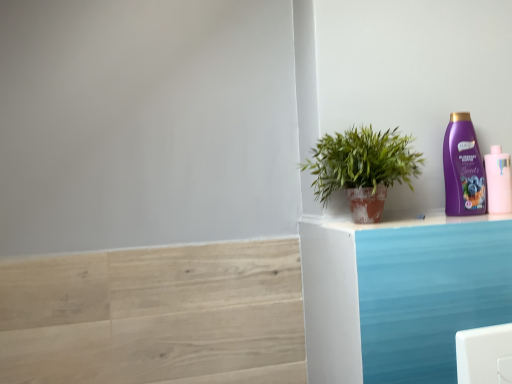
Question: Choose the correct answer: Is pink matte bottle at upper right, the second bottle from the left, inside green leafy plant in terracotta pot at right or outside it?

Choices:
 (A) inside
 (B) outside

Answer: (B)

Question: From the image's perspective, is pink matte bottle at upper right, the first bottle viewed from the right, positioned above or below green leafy plant in terracotta pot at right?

Choices:
 (A) above
 (B) below

Answer: (B)

Question: Which is farther from the green leafy plant in terracotta pot at right?

Choices:
 (A) pink matte bottle at upper right, the first bottle viewed from the right
 (B) light wood stair at lower left
 (C) purple glossy shampoo bottle at upper right, the 1th bottle viewed from the left

Answer: (B)

Question: Estimate the real-world distances between objects in this image. Which object is closer to the pink matte bottle at upper right, the first bottle viewed from the right?

Choices:
 (A) green leafy plant in terracotta pot at right
 (B) purple glossy shampoo bottle at upper right, marked as the second bottle in a right-to-left arrangement
 (C) light wood stair at lower left

Answer: (B)